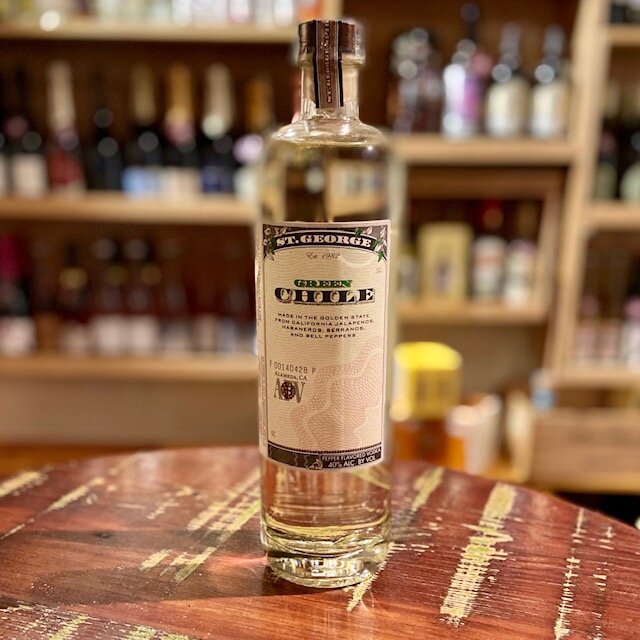
The width and height of the screenshot is (640, 640). What are the coordinates of `shelf` in the screenshot? It's located at (67, 364), (127, 214), (118, 32), (427, 148), (458, 314), (616, 224), (621, 35).